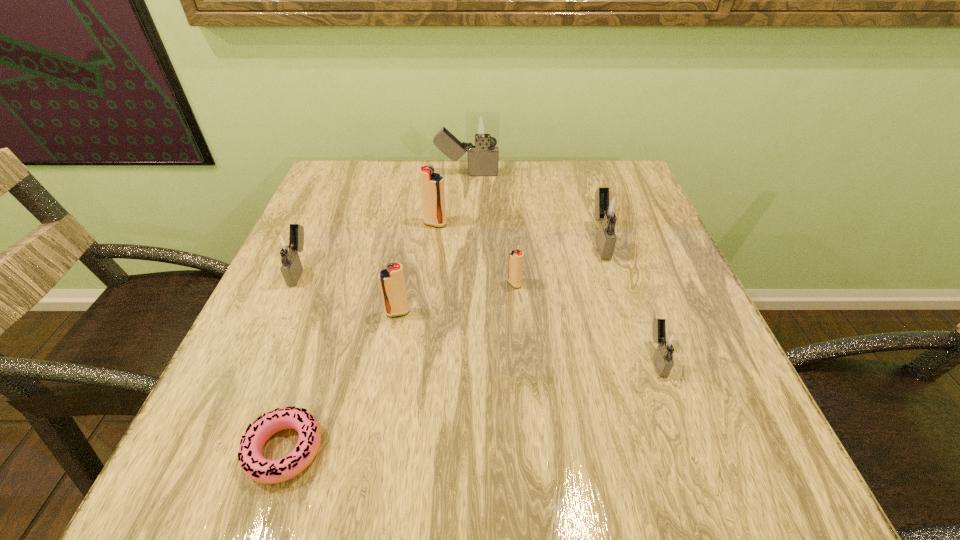
The height and width of the screenshot is (540, 960). I want to click on vacant region located on the front of the second farthest red igniter, so coord(528,452).

Locate an element on the screen. This screenshot has height=540, width=960. free spot located on the back of the second nearest object is located at coordinates (638, 306).

Image resolution: width=960 pixels, height=540 pixels. In order to click on free region located 0.370m on the right of the nearest object in this screenshot , I will do `click(574, 450)`.

Locate an element on the screen. object that is positioned at the far edge is located at coordinates (482, 128).

Where is `object positioned at the near edge`? object positioned at the near edge is located at coordinates (255, 466).

In order to click on igniter positioned at the left edge in this screenshot , I will do `click(288, 246)`.

The image size is (960, 540). Find the location of `doughnut that is at the left edge`. doughnut that is at the left edge is located at coordinates (255, 466).

Identify the location of object positioned at the near left corner. This screenshot has width=960, height=540. (255, 466).

Identify the location of vacant region at the far edge. The image size is (960, 540). (493, 180).

Identify the location of vacant space at the near edge of the desktop. (290, 498).